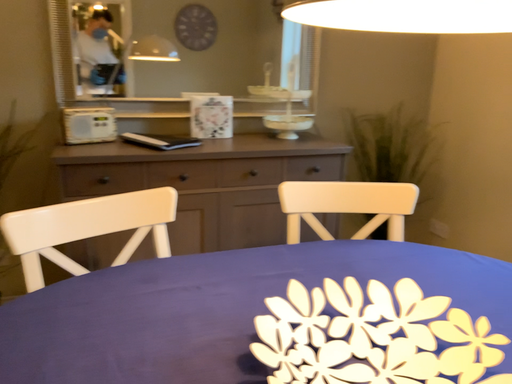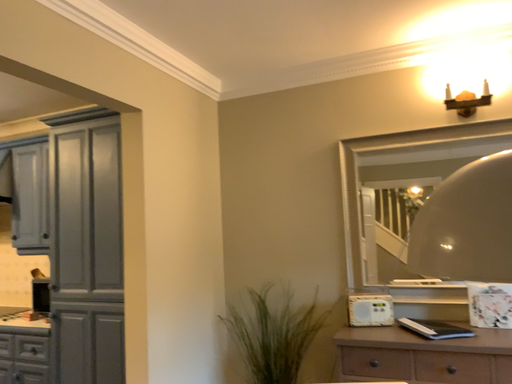
Question: Which way did the camera rotate in the video?

Choices:
 (A) rotated downward
 (B) rotated upward

Answer: (B)